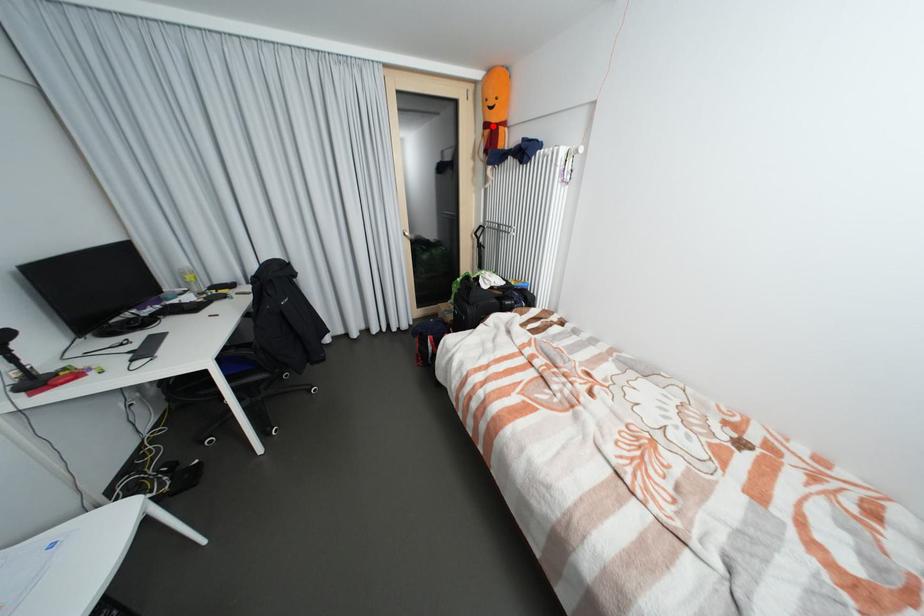
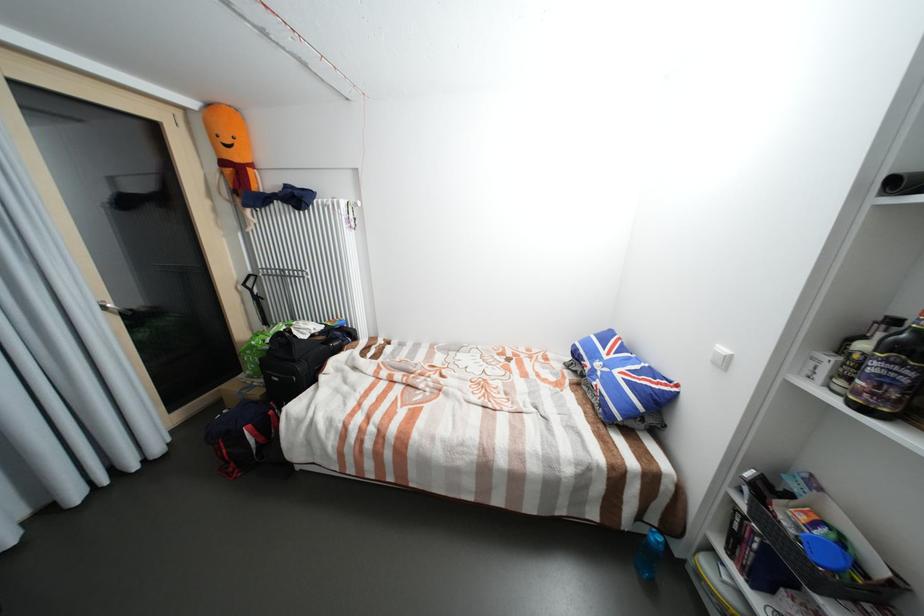
Question: A red point is marked in image1. In image2, is the corresponding 3D point closer to the camera or farther? Reply with the corresponding letter.

Choices:
 (A) The corresponding 3D point is closer.
 (B) The corresponding 3D point is farther.

Answer: (B)